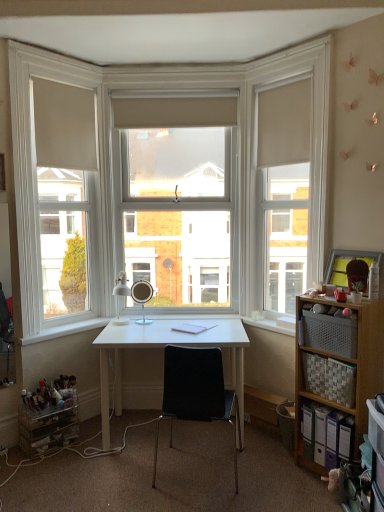
At what (x,y) coordinates should I click in order to perform the action: click on blank space above white matte window frame at left, the first window frame from the left (from a real-world perspective). Please return your answer as a coordinate pair (x, y). Looking at the image, I should click on (56, 55).